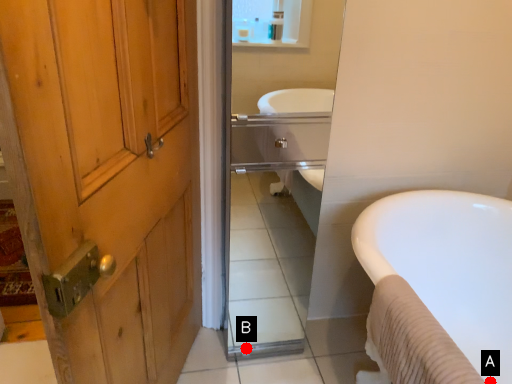
Question: Two points are circled on the image, labeled by A and B beside each circle. Which point is closer to the camera?

Choices:
 (A) A is closer
 (B) B is closer

Answer: (A)